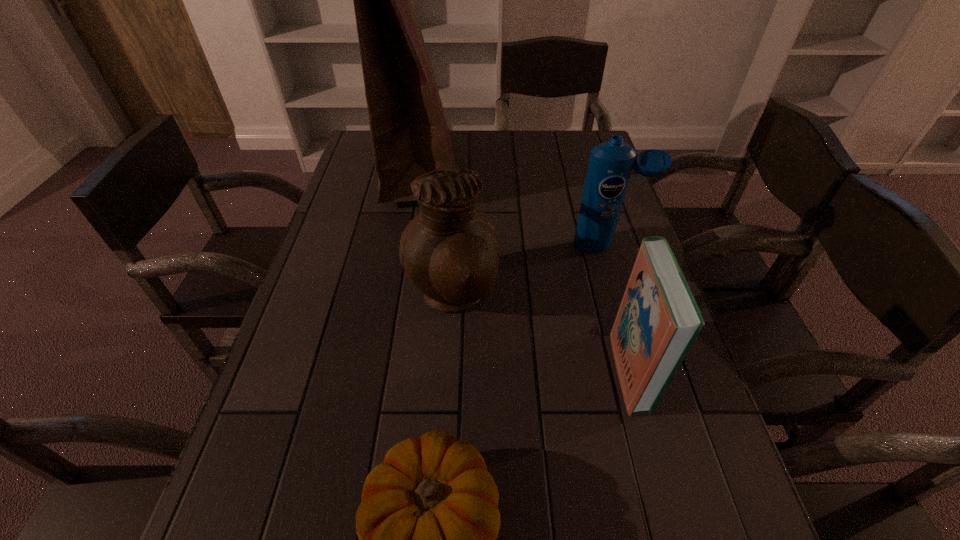
At what (x,y) coordinates should I click in order to perform the action: click on free space between the shampoo and the pitcher. Please return your answer as a coordinate pair (x, y). Looking at the image, I should click on (530, 271).

Find the location of a particular element. free space between the pitcher and the shampoo is located at coordinates (530, 271).

Where is `free spot between the shampoo and the pitcher`? The width and height of the screenshot is (960, 540). free spot between the shampoo and the pitcher is located at coordinates (530, 271).

What are the coordinates of `vacant space that is in between the shampoo and the hardback book` in the screenshot? It's located at (618, 308).

Identify the location of object that is the nearest to the pitcher. (409, 132).

At what (x,y) coordinates should I click in order to perform the action: click on object that is the fourth closest to the shampoo. Please return your answer as a coordinate pair (x, y). The image size is (960, 540). Looking at the image, I should click on (427, 525).

Where is `free space that satisfies the following two spatial constraints: 1. on the front-facing side of the tallest object; 2. on the left side of the shampoo`? free space that satisfies the following two spatial constraints: 1. on the front-facing side of the tallest object; 2. on the left side of the shampoo is located at coordinates (405, 245).